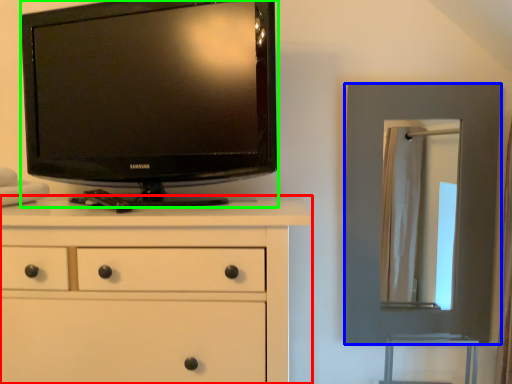
Question: Which object is positioned farthest from chest of drawers (highlighted by a red box)? Select from picture frame (highlighted by a blue box) and television (highlighted by a green box).

Choices:
 (A) picture frame
 (B) television

Answer: (A)